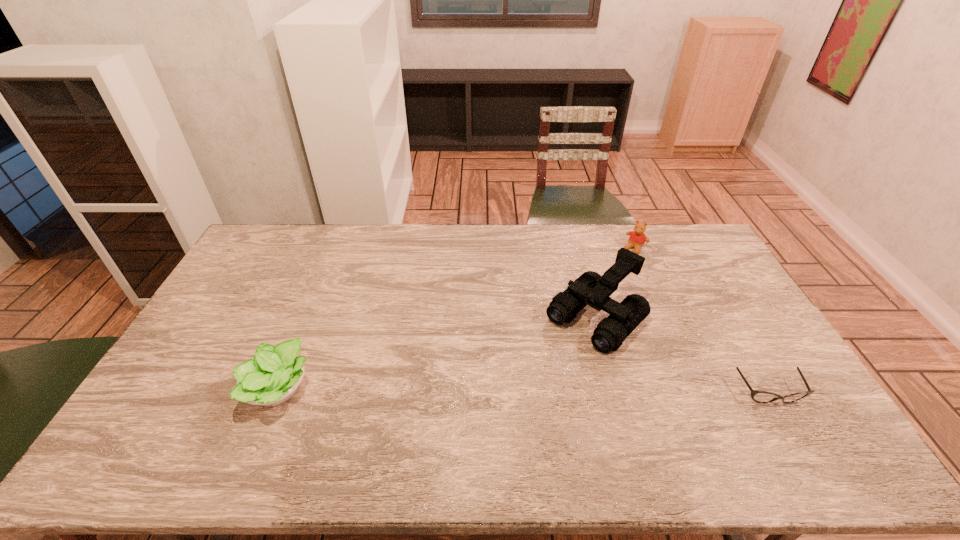
I want to click on free space at the far edge, so click(485, 261).

I want to click on vacant space at the near edge, so click(702, 415).

In the image, there is a desktop. What are the coordinates of `free space at the left edge` in the screenshot? It's located at (211, 398).

This screenshot has height=540, width=960. In order to click on free spot at the far left corner of the desktop in this screenshot , I will do `click(295, 240)`.

Locate an element on the screen. vacant space at the near left corner of the desktop is located at coordinates [180, 424].

This screenshot has height=540, width=960. I want to click on free space between the teddy bear and the spectacles, so [702, 320].

The height and width of the screenshot is (540, 960). In order to click on blank region between the lettuce and the teddy bear in this screenshot , I will do `click(457, 319)`.

This screenshot has width=960, height=540. I want to click on free point between the tallest object and the leftmost object, so click(x=438, y=354).

Identify the location of free spot between the second object from right to left and the leftmost object. The height and width of the screenshot is (540, 960). (457, 319).

You are a GUI agent. You are given a task and a screenshot of the screen. Output one action in this format:
    pyautogui.click(x=<x>, y=<y>)
    Task: Click on the empty space between the third object from right to left and the lettuce
    The height and width of the screenshot is (540, 960).
    Given the screenshot: What is the action you would take?
    pos(438,354)